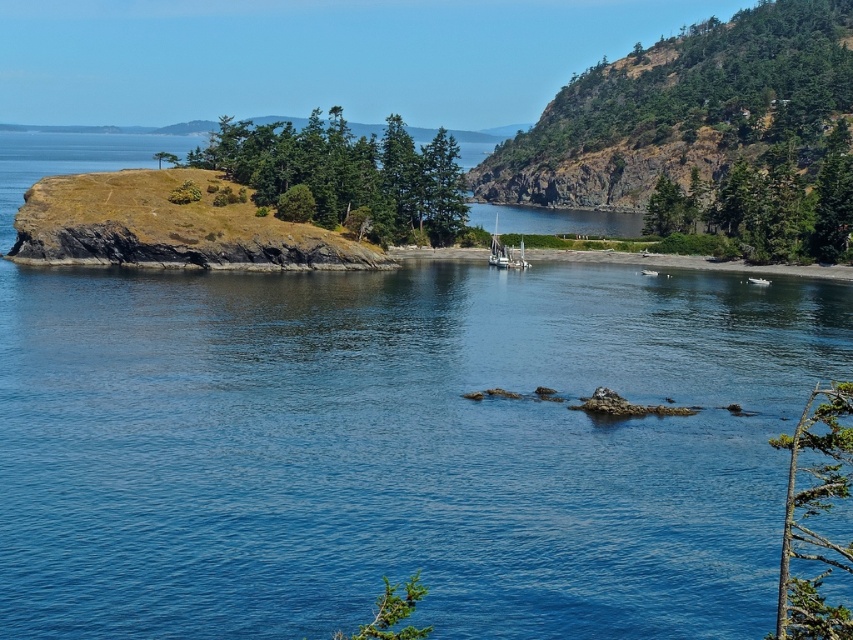
You are standing at the viewpoint overlooking the coastal landscape. There are two points marked in the image. The first point is at coordinates point (132, 381) and the second point is at point (519, 243). Which of these two points is closer to you?

Point (132, 381) is closer to the viewer than point (519, 243).

You are a photographer planning to take a photo of the clear blue water at center and the wooden sailboat at center. Based on their sizes in the image, which object should you focus on first if you want to ensure both are in sharp focus?

The clear blue water at center is much taller than the wooden sailboat at center, so focusing on the clear blue water at center first would ensure both are in sharp focus since it occupies more space in the frame.